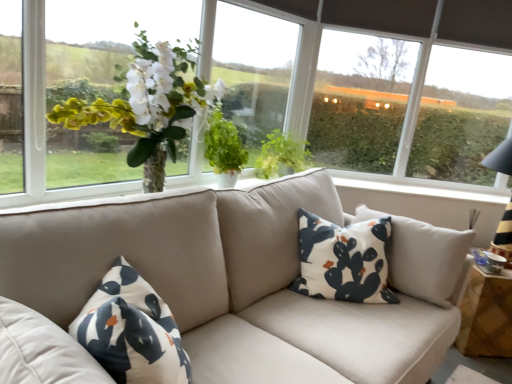
Identify the location of matte glass vase at center. The image size is (512, 384). (147, 105).

Measure the distance between point [256,94] and camera.

Point [256,94] and camera are 8.80 feet apart.

The width and height of the screenshot is (512, 384). What do you see at coordinates (486, 314) in the screenshot?
I see `wooden side table at right` at bounding box center [486, 314].

The height and width of the screenshot is (384, 512). Find the location of `transparent plastic window screen at upper right, the second window screen when ordered from left to right`. transparent plastic window screen at upper right, the second window screen when ordered from left to right is located at coordinates (408, 107).

Where is `green leafy plant at center`? green leafy plant at center is located at coordinates (282, 156).

Image resolution: width=512 pixels, height=384 pixels. What do you see at coordinates (344, 260) in the screenshot? I see `white cotton pillow at center` at bounding box center [344, 260].

Where is `matte glass vase at center`? This screenshot has width=512, height=384. matte glass vase at center is located at coordinates (147, 105).

Is white cotton pillow at center taller than wooden side table at right?

Correct, white cotton pillow at center is much taller as wooden side table at right.

Can you tell me how much white cotton pillow at center and wooden side table at right differ in facing direction?

white cotton pillow at center and wooden side table at right are facing 7.29 degrees away from each other.

At what (x,y) coordinates should I click in order to perform the action: click on pillow in front of the wooden side table at right. Please return your answer as a coordinate pair (x, y). Looking at the image, I should click on (344, 260).

Does point (362, 293) come behind point (460, 305)?

No.

Considering the sizes of objects white cotton pillow at center and transparent glass window at center, the 2th window screen viewed from the right, in the image provided, who is wider, white cotton pillow at center or transparent glass window at center, the 2th window screen viewed from the right,?

With larger width is white cotton pillow at center.

Is transparent glass window at center, the 2th window screen viewed from the right, at the back of white cotton pillow at center?

No, transparent glass window at center, the 2th window screen viewed from the right, is not at the back of white cotton pillow at center.

Is white cotton pillow at center touching transparent glass window at center, the 2th window screen viewed from the right?

No, white cotton pillow at center is not next to transparent glass window at center, the 2th window screen viewed from the right.

Considering the sizes of white cotton pillow at center and transparent glass window at center, placed as the first window screen when sorted from left to right, in the image, is white cotton pillow at center taller or shorter than transparent glass window at center, placed as the first window screen when sorted from left to right,?

Clearly, white cotton pillow at center is shorter compared to transparent glass window at center, placed as the first window screen when sorted from left to right.

Are green leafy plant at center and transparent plastic window screen at upper right, the second window screen when ordered from left to right, located far from each other?

Indeed, green leafy plant at center is not near transparent plastic window screen at upper right, the second window screen when ordered from left to right.

Based on the photo, which is more to the left, green leafy plant at center or transparent plastic window screen at upper right, the second window screen when ordered from left to right?

Positioned to the left is green leafy plant at center.

Which of these two, green leafy plant at center or transparent plastic window screen at upper right, acting as the 1th window screen starting from the right, is smaller?

Smaller between the two is green leafy plant at center.

Is green leafy plant at center positioned with its back to transparent plastic window screen at upper right, the second window screen when ordered from left to right?

That's not correct — green leafy plant at center is not looking away from transparent plastic window screen at upper right, the second window screen when ordered from left to right.

Is point (486, 346) more distant than point (457, 147)?

No, (486, 346) is closer to viewer.

Is wooden side table at right with transparent plastic window screen at upper right, acting as the 1th window screen starting from the right?

No.

Considering the sizes of objects wooden side table at right and transparent plastic window screen at upper right, the second window screen when ordered from left to right, in the image provided, who is thinner, wooden side table at right or transparent plastic window screen at upper right, the second window screen when ordered from left to right,?

transparent plastic window screen at upper right, the second window screen when ordered from left to right, is thinner.

Based on the photo, does transparent glass window at center, placed as the first window screen when sorted from left to right, appear on the right side of transparent plastic window screen at upper right, acting as the 1th window screen starting from the right?

Incorrect, transparent glass window at center, placed as the first window screen when sorted from left to right, is not on the right side of transparent plastic window screen at upper right, acting as the 1th window screen starting from the right.

From a real-world perspective, who is located higher, transparent glass window at center, the 2th window screen viewed from the right, or transparent plastic window screen at upper right, the second window screen when ordered from left to right?

In real-world perspective, transparent plastic window screen at upper right, the second window screen when ordered from left to right, is above.

Can you confirm if transparent glass window at center, placed as the first window screen when sorted from left to right, is bigger than transparent plastic window screen at upper right, acting as the 1th window screen starting from the right?

Actually, transparent glass window at center, placed as the first window screen when sorted from left to right, might be smaller than transparent plastic window screen at upper right, acting as the 1th window screen starting from the right.

How different are the orientations of transparent glass window at center, placed as the first window screen when sorted from left to right, and transparent plastic window screen at upper right, acting as the 1th window screen starting from the right, in degrees?

The angular difference between transparent glass window at center, placed as the first window screen when sorted from left to right, and transparent plastic window screen at upper right, acting as the 1th window screen starting from the right, is 45.9 degrees.

Would you say green leafy plant at center is a long distance from transparent glass window at center, placed as the first window screen when sorted from left to right?

No, green leafy plant at center is in close proximity to transparent glass window at center, placed as the first window screen when sorted from left to right.

Does green leafy plant at center have a lesser width compared to transparent glass window at center, placed as the first window screen when sorted from left to right?

No.

Is green leafy plant at center not inside transparent glass window at center, placed as the first window screen when sorted from left to right?

Yes, green leafy plant at center is outside of transparent glass window at center, placed as the first window screen when sorted from left to right.

Which is less distant, (306, 168) or (256, 27)?

Point (256, 27)

Can you confirm if matte glass vase at center is positioned to the right of transparent glass window at center, the 2th window screen viewed from the right?

No, matte glass vase at center is not to the right of transparent glass window at center, the 2th window screen viewed from the right.

Locate an element on the screen. This screenshot has height=384, width=512. floral arrangement lying on the left of transparent glass window at center, the 2th window screen viewed from the right is located at coordinates (147, 105).

Is matte glass vase at center wider or thinner than transparent glass window at center, placed as the first window screen when sorted from left to right?

matte glass vase at center is wider than transparent glass window at center, placed as the first window screen when sorted from left to right.

Are matte glass vase at center and transparent glass window at center, placed as the first window screen when sorted from left to right, making contact?

No, matte glass vase at center is not touching transparent glass window at center, placed as the first window screen when sorted from left to right.

Where is `table on the right of white cotton pillow at center`? The image size is (512, 384). table on the right of white cotton pillow at center is located at coordinates (486, 314).

The height and width of the screenshot is (384, 512). What are the coordinates of `pillow that is in front of the transparent glass window at center, placed as the first window screen when sorted from left to right` in the screenshot? It's located at (344, 260).

Considering their positions, is green leafy plant at center positioned closer to matte glass vase at center than transparent plastic window screen at upper right, acting as the 1th window screen starting from the right?

Based on the image, green leafy plant at center appears to be nearer to matte glass vase at center.

From the image, which object appears to be farther from transparent glass window at center, the 2th window screen viewed from the right, matte glass vase at center or transparent plastic window screen at upper right, acting as the 1th window screen starting from the right?

transparent plastic window screen at upper right, acting as the 1th window screen starting from the right.

Consider the image. Considering their positions, is green leafy plant at center positioned further to white cotton pillow at center than matte glass vase at center?

matte glass vase at center.

Based on their spatial positions, is green leafy plant at center or transparent plastic window screen at upper right, the second window screen when ordered from left to right, further from white cotton pillow at center?

Based on the image, transparent plastic window screen at upper right, the second window screen when ordered from left to right, appears to be further to white cotton pillow at center.

Estimate the real-world distances between objects in this image. Which object is closer to transparent plastic window screen at upper right, acting as the 1th window screen starting from the right, green leafy plant at center or transparent glass window at center, placed as the first window screen when sorted from left to right?

Based on the image, transparent glass window at center, placed as the first window screen when sorted from left to right, appears to be nearer to transparent plastic window screen at upper right, acting as the 1th window screen starting from the right.

Estimate the real-world distances between objects in this image. Which object is closer to wooden side table at right, matte glass vase at center or green leafy plant at center?

Among the two, green leafy plant at center is located nearer to wooden side table at right.

Considering their positions, is matte glass vase at center positioned closer to white cotton pillow at center than transparent glass window at center, placed as the first window screen when sorted from left to right?

matte glass vase at center is closer to white cotton pillow at center.

From the image, which object appears to be nearer to transparent plastic window screen at upper right, acting as the 1th window screen starting from the right, green leafy plant at center or matte glass vase at center?

Among the two, green leafy plant at center is located nearer to transparent plastic window screen at upper right, acting as the 1th window screen starting from the right.

Identify the location of plant between transparent glass window at center, placed as the first window screen when sorted from left to right, and wooden side table at right. (282, 156).

Locate an element on the screen. The height and width of the screenshot is (384, 512). pillow between green leafy plant at center and transparent plastic window screen at upper right, the second window screen when ordered from left to right is located at coordinates (344, 260).

You are a GUI agent. You are given a task and a screenshot of the screen. Output one action in this format:
    pyautogui.click(x=<x>, y=<y>)
    Task: Click on the floral arrangement between transparent glass window at center, placed as the first window screen when sorted from left to right, and white cotton pillow at center from top to bottom
    
    Given the screenshot: What is the action you would take?
    pyautogui.click(x=147, y=105)

Locate an element on the screen. The width and height of the screenshot is (512, 384). pillow between transparent plastic window screen at upper right, acting as the 1th window screen starting from the right, and wooden side table at right vertically is located at coordinates (344, 260).